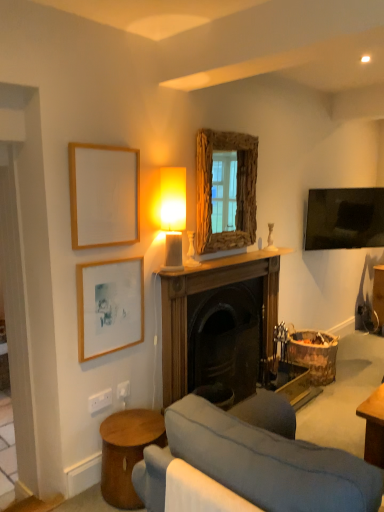
Question: In terms of width, does matte white table lamp at upper center look wider or thinner when compared to velvet grey couch at lower center?

Choices:
 (A) wide
 (B) thin

Answer: (B)

Question: Do you think matte white table lamp at upper center is within velvet grey couch at lower center, or outside of it?

Choices:
 (A) inside
 (B) outside

Answer: (B)

Question: Which object is positioned closest to the matte wooden picture frame at upper left, the second picture frame positioned from the bottom?

Choices:
 (A) wooden picture frame at lower left, positioned as the 1th picture frame in bottom-to-top order
 (B) matte white table lamp at upper center
 (C) wooden side table at lower left
 (D) wooden fireplace at center
 (E) rustic wood mirror at upper center

Answer: (B)

Question: Based on their relative distances, which object is nearer to the matte wooden picture frame at upper left, the second picture frame positioned from the bottom?

Choices:
 (A) wooden side table at lower left
 (B) rustic wood mirror at upper center
 (C) velvet grey couch at lower center
 (D) wooden picture frame at lower left, positioned as the 1th picture frame in bottom-to-top order
 (E) wooden fireplace at center

Answer: (D)